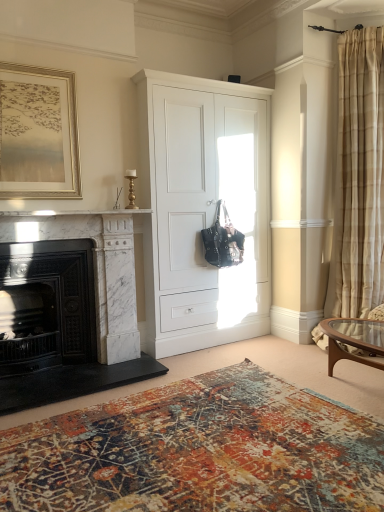
Question: Are white marble fireplace at left and gold metallic picture frame at upper left far apart?

Choices:
 (A) no
 (B) yes

Answer: (A)

Question: Can you confirm if white marble fireplace at left is positioned to the right of gold metallic picture frame at upper left?

Choices:
 (A) yes
 (B) no

Answer: (A)

Question: Is white marble fireplace at left bigger than gold metallic picture frame at upper left?

Choices:
 (A) no
 (B) yes

Answer: (A)

Question: Can you confirm if white marble fireplace at left is smaller than gold metallic picture frame at upper left?

Choices:
 (A) no
 (B) yes

Answer: (B)

Question: Is the position of white marble fireplace at left more distant than that of gold metallic picture frame at upper left?

Choices:
 (A) yes
 (B) no

Answer: (B)

Question: Do you think textured rug at lower center is within white matte cabinet at center, or outside of it?

Choices:
 (A) outside
 (B) inside

Answer: (A)

Question: From the image's perspective, relative to white matte cabinet at center, is textured rug at lower center above or below?

Choices:
 (A) below
 (B) above

Answer: (A)

Question: From a real-world perspective, is textured rug at lower center above or below white matte cabinet at center?

Choices:
 (A) above
 (B) below

Answer: (B)

Question: In terms of width, does textured rug at lower center look wider or thinner when compared to white matte cabinet at center?

Choices:
 (A) wide
 (B) thin

Answer: (A)

Question: Is white matte cabinet at center taller or shorter than gold metallic picture frame at upper left?

Choices:
 (A) tall
 (B) short

Answer: (A)

Question: From the image's perspective, is white matte cabinet at center positioned above or below gold metallic picture frame at upper left?

Choices:
 (A) above
 (B) below

Answer: (B)

Question: Is white matte cabinet at center inside or outside of gold metallic picture frame at upper left?

Choices:
 (A) outside
 (B) inside

Answer: (A)

Question: Considering the positions of point (x=268, y=178) and point (x=56, y=75), is point (x=268, y=178) closer or farther from the camera than point (x=56, y=75)?

Choices:
 (A) closer
 (B) farther

Answer: (B)

Question: In terms of width, does white marble fireplace at left, the 1th fireplace viewed from the right, look wider or thinner when compared to white matte cabinet at center?

Choices:
 (A) thin
 (B) wide

Answer: (A)

Question: Based on their positions, is white marble fireplace at left, the 1th fireplace viewed from the right, located to the left or right of white matte cabinet at center?

Choices:
 (A) right
 (B) left

Answer: (B)